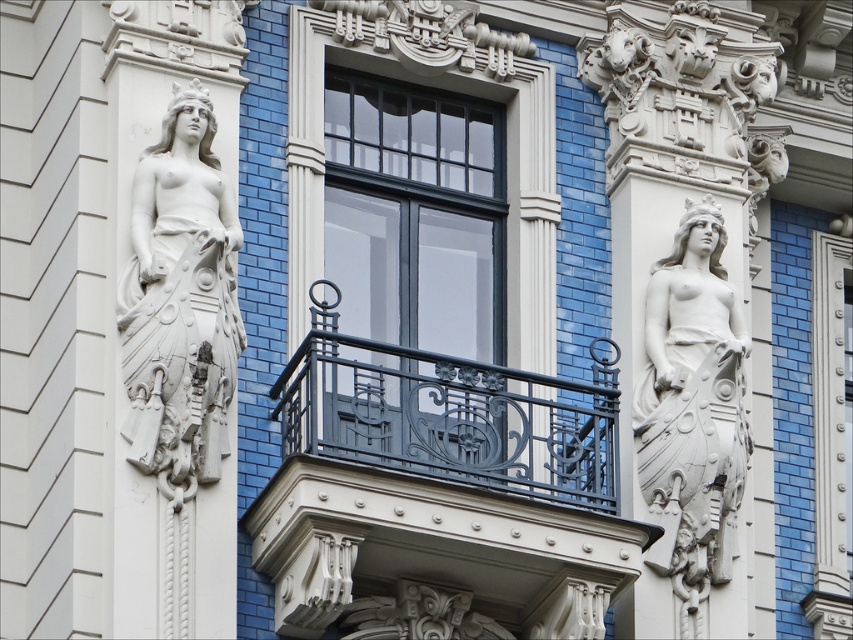
Which is in front, point (207, 337) or point (457, 19)?

Point (207, 337)

Can you confirm if white stone statue at left is positioned to the right of matte black window at center?

In fact, white stone statue at left is to the left of matte black window at center.

Locate an element on the screen. The image size is (853, 640). white stone statue at left is located at coordinates (180, 304).

Does dark gray wrought iron balcony at center appear over white stone statue at left?

Incorrect, dark gray wrought iron balcony at center is not positioned above white stone statue at left.

Is dark gray wrought iron balcony at center to the left of white stone statue at left from the viewer's perspective?

No, dark gray wrought iron balcony at center is not to the left of white stone statue at left.

This screenshot has height=640, width=853. Find the location of `dark gray wrought iron balcony at center`. dark gray wrought iron balcony at center is located at coordinates click(440, 492).

Locate an element on the screen. This screenshot has height=640, width=853. dark gray wrought iron balcony at center is located at coordinates pyautogui.click(x=440, y=492).

Between point (657, 346) and point (143, 388), which one is positioned in front?

Positioned in front is point (143, 388).

Is point (614, 83) behind point (190, 428)?

Yes, it is behind point (190, 428).

I want to click on white stone statue at center, so point(682,294).